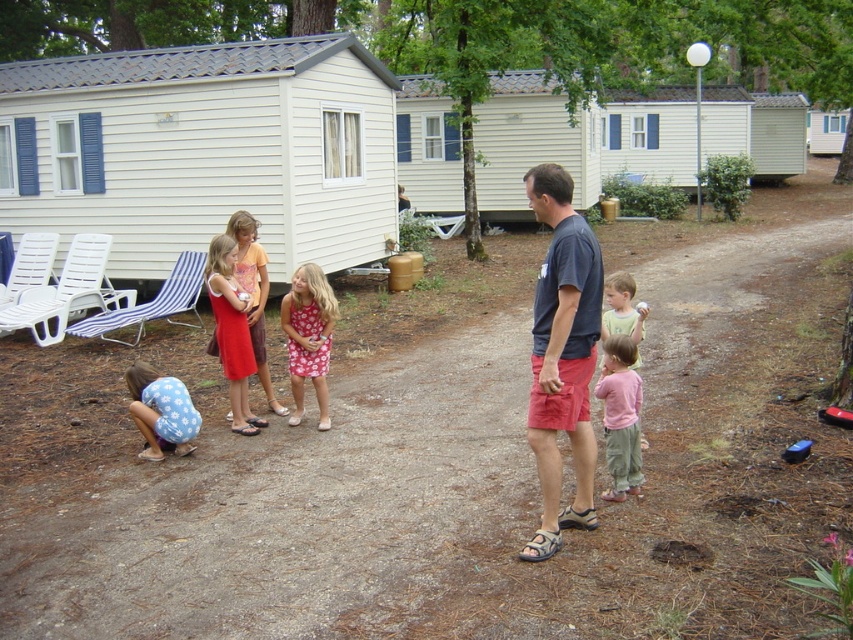
Can you confirm if pink cotton shirt at center is positioned to the left of pink cotton shirt at right?

Indeed, pink cotton shirt at center is positioned on the left side of pink cotton shirt at right.

Who is higher up, pink cotton shirt at center or pink cotton shirt at right?

pink cotton shirt at right is above.

Is point (635, 460) more distant than point (613, 292)?

No, (635, 460) is closer to viewer.

The width and height of the screenshot is (853, 640). What are the coordinates of `pink cotton shirt at center` in the screenshot? It's located at (619, 417).

Is dark gray t-shirt at center behind pink floral dress at center?

No, dark gray t-shirt at center is closer to the viewer.

In the scene shown: Can you confirm if dark gray t-shirt at center is wider than pink floral dress at center?

No.

Does point (569, 406) come closer to viewer compared to point (288, 324)?

Yes, point (569, 406) is closer to viewer.

The image size is (853, 640). What are the coordinates of `dark gray t-shirt at center` in the screenshot? It's located at (561, 355).

Can you confirm if dark gray t-shirt at center is wider than pink cotton shirt at center?

Indeed, dark gray t-shirt at center has a greater width compared to pink cotton shirt at center.

Between dark gray t-shirt at center and pink cotton shirt at center, which one appears on the right side from the viewer's perspective?

From the viewer's perspective, pink cotton shirt at center appears more on the right side.

Is point (531, 403) farther from viewer compared to point (622, 413)?

No, it is in front of (622, 413).

Locate an element on the screen. The height and width of the screenshot is (640, 853). dark gray t-shirt at center is located at coordinates (561, 355).